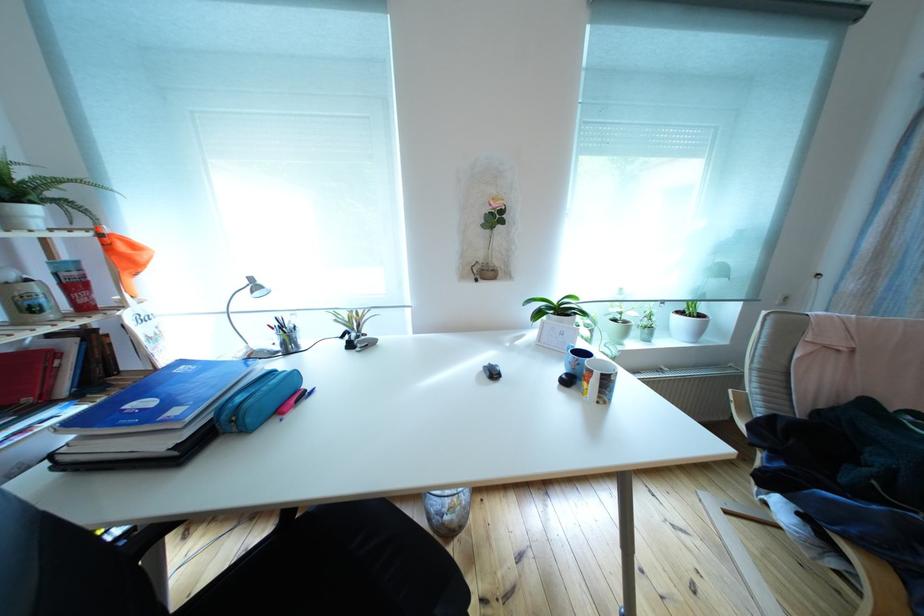
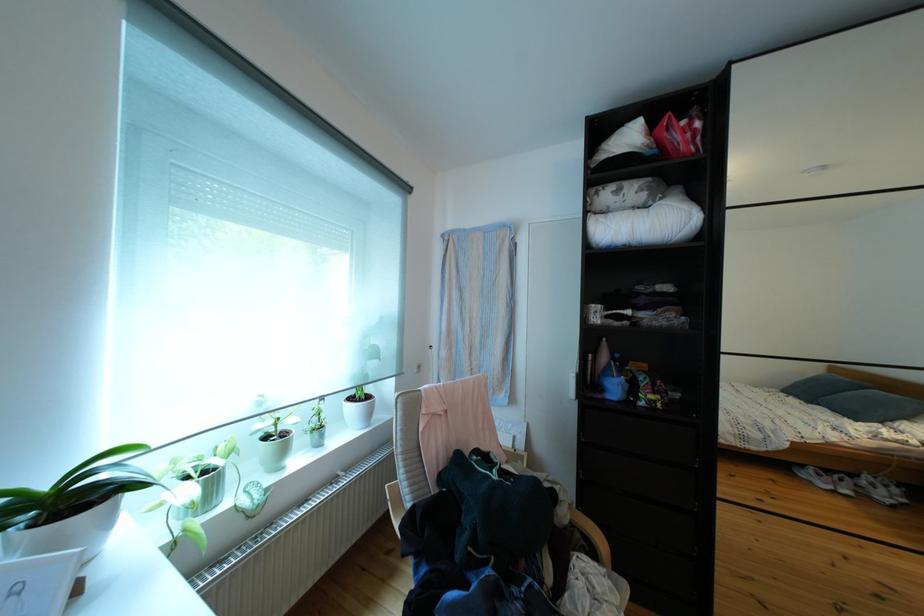
The point at (626,326) is marked in the first image. Where is the corresponding point in the second image?

(276, 445)